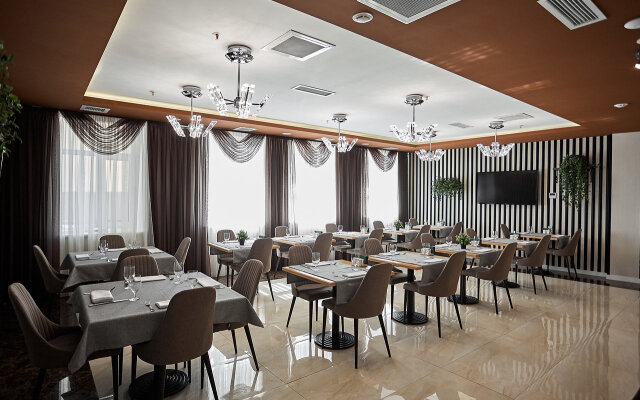
The image size is (640, 400). What are the coordinates of `glass hanging ceiling lights` in the screenshot? It's located at (237, 95), (194, 124), (408, 127), (428, 148), (493, 139), (342, 136).